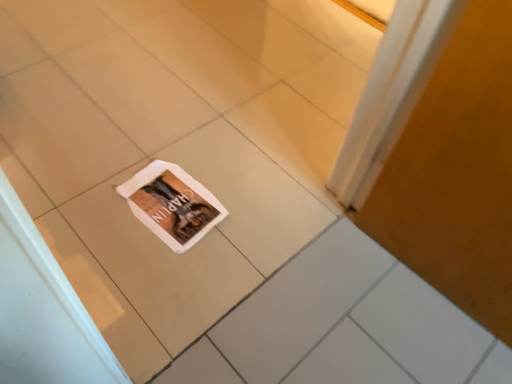
Identify the location of empty space that is ontop of white paper postcard at center. The height and width of the screenshot is (384, 512). (170, 196).